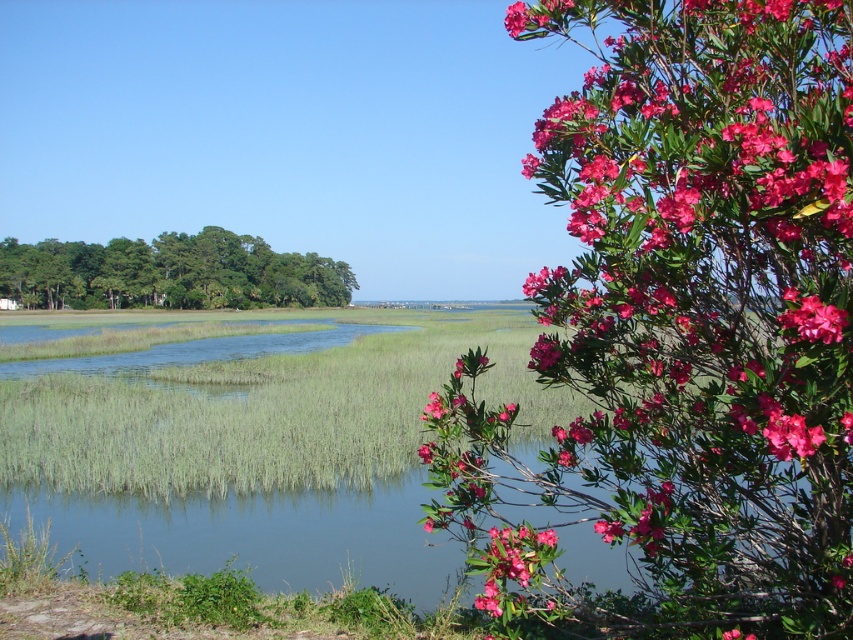
Question: Among these objects, which one is nearest to the camera?

Choices:
 (A) pink matte flower at upper right
 (B) green leafy trees at left

Answer: (A)

Question: Which of the following is the closest to the observer?

Choices:
 (A) [x=233, y=298]
 (B) [x=508, y=557]
 (C) [x=819, y=627]

Answer: (C)

Question: Is the position of green leafy trees at left less distant than that of pink matte flower at upper right?

Choices:
 (A) yes
 (B) no

Answer: (B)

Question: Is green leafy trees at left thinner than pink matte flower at upper right?

Choices:
 (A) no
 (B) yes

Answer: (A)

Question: Observing the image, what is the correct spatial positioning of green leafy trees at left in reference to pink matte flower at upper right?

Choices:
 (A) left
 (B) right

Answer: (A)

Question: Which point is closer to the camera?

Choices:
 (A) (318, 266)
 (B) (792, 4)
 (C) (550, 536)

Answer: (B)